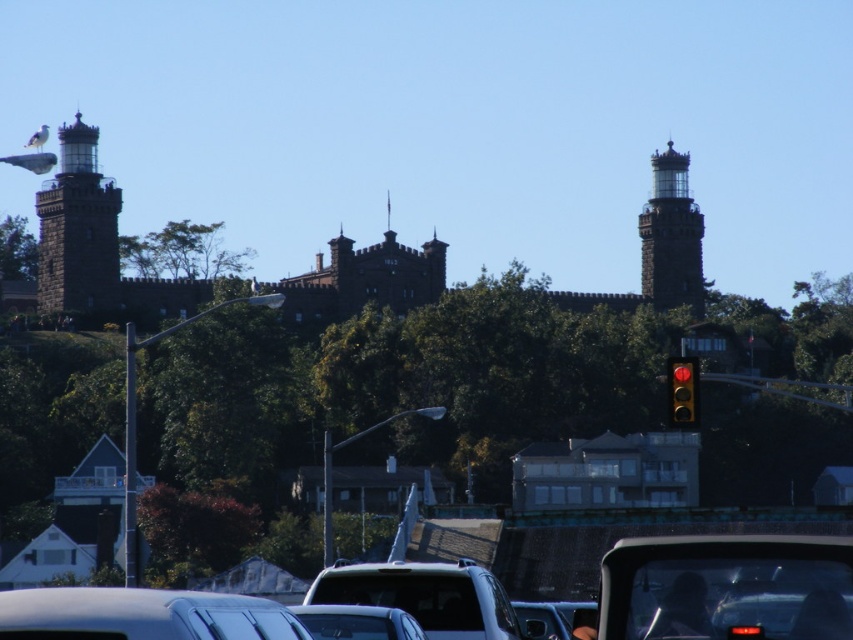
Question: Which point is farther to the camera?

Choices:
 (A) (364, 596)
 (B) (374, 614)
 (C) (157, 595)
 (D) (688, 275)

Answer: (D)

Question: Where is satin black suv at center located in relation to dark gray stone tower at upper right in the image?

Choices:
 (A) left
 (B) right

Answer: (A)

Question: Which of the following is the closest to the observer?

Choices:
 (A) (293, 628)
 (B) (665, 616)
 (C) (425, 605)
 (D) (376, 618)

Answer: (A)

Question: Is metallic silver car at lower left smaller than satin black suv at center?

Choices:
 (A) no
 (B) yes

Answer: (A)

Question: Does metallic silver car at center have a greater width compared to red glass traffic light at right?

Choices:
 (A) no
 (B) yes

Answer: (B)

Question: Which point is closer to the camera?

Choices:
 (A) dark gray stone lighthouse at left
 (B) metallic silver car at center
 (C) metallic silver car at lower left

Answer: (C)